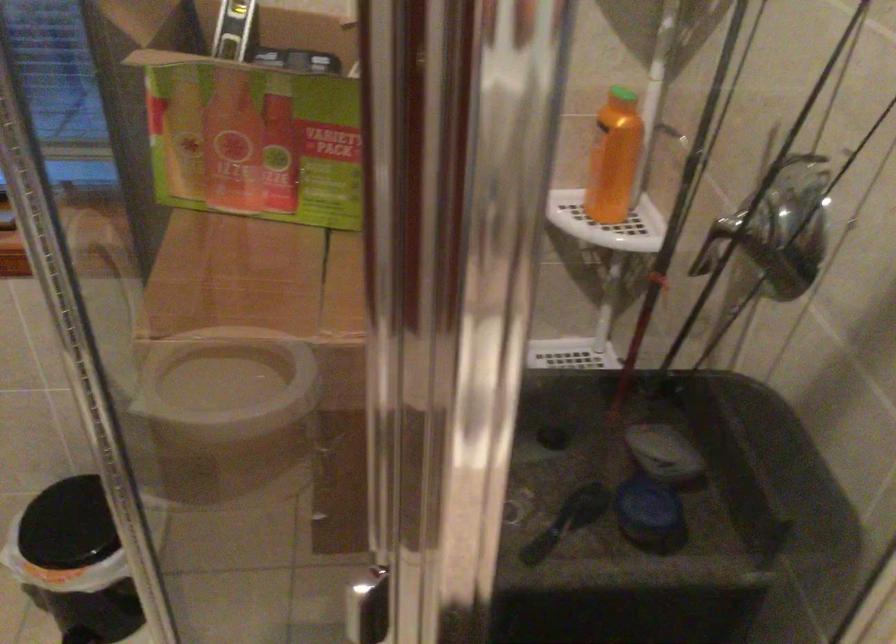
The image size is (896, 644). Find the location of `black brush handle`. black brush handle is located at coordinates (548, 536).